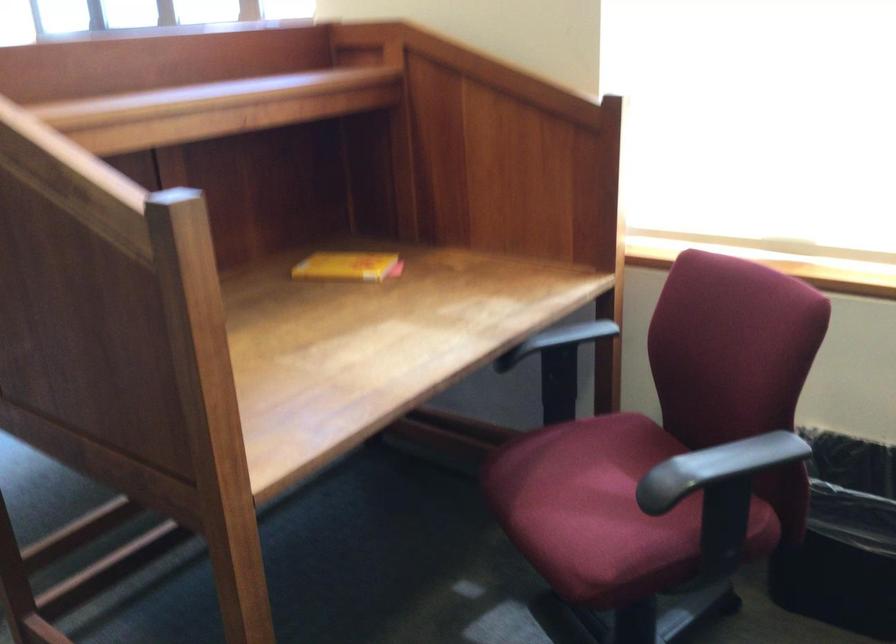
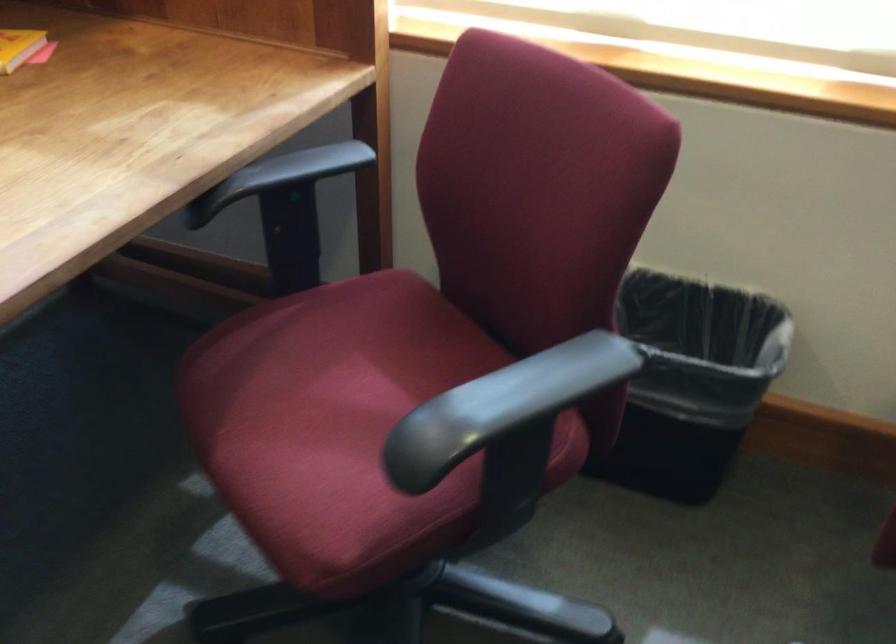
Question: What movement of the cameraman would produce the second image?

Choices:
 (A) Left
 (B) Right
 (C) Forward
 (D) Backward

Answer: (C)